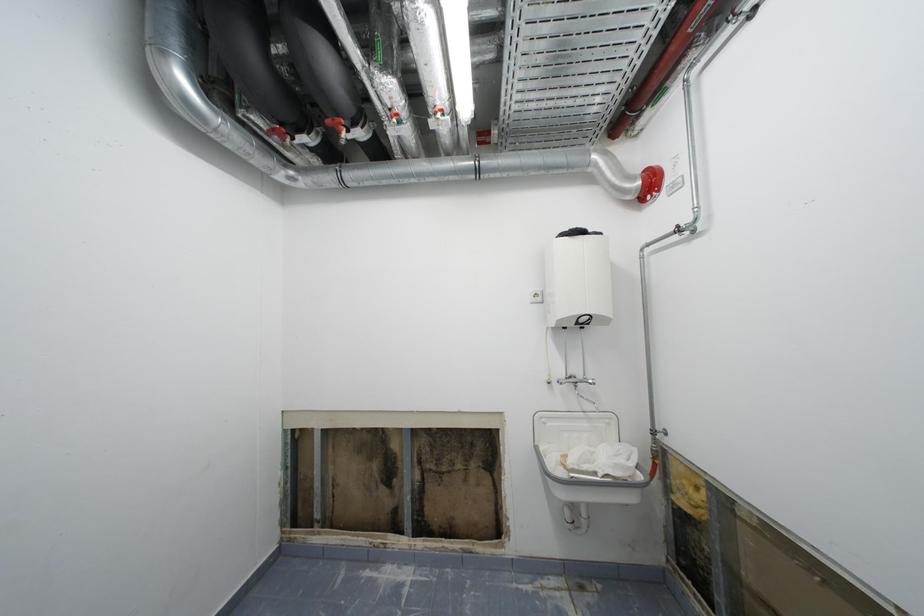
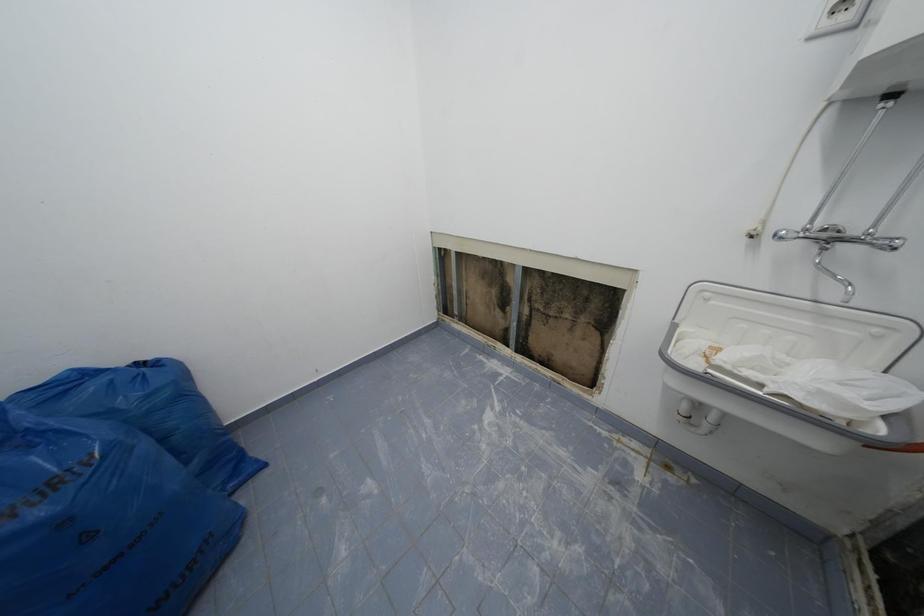
The images are taken continuously from a first-person perspective. In which direction is your viewpoint rotating?

The camera's rotation is toward left-down.